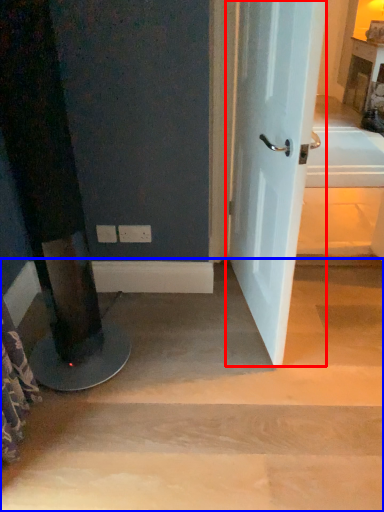
Question: Among these objects, which one is farthest to the camera, door (highlighted by a red box) or stairwell (highlighted by a blue box)?

Choices:
 (A) door
 (B) stairwell

Answer: (B)